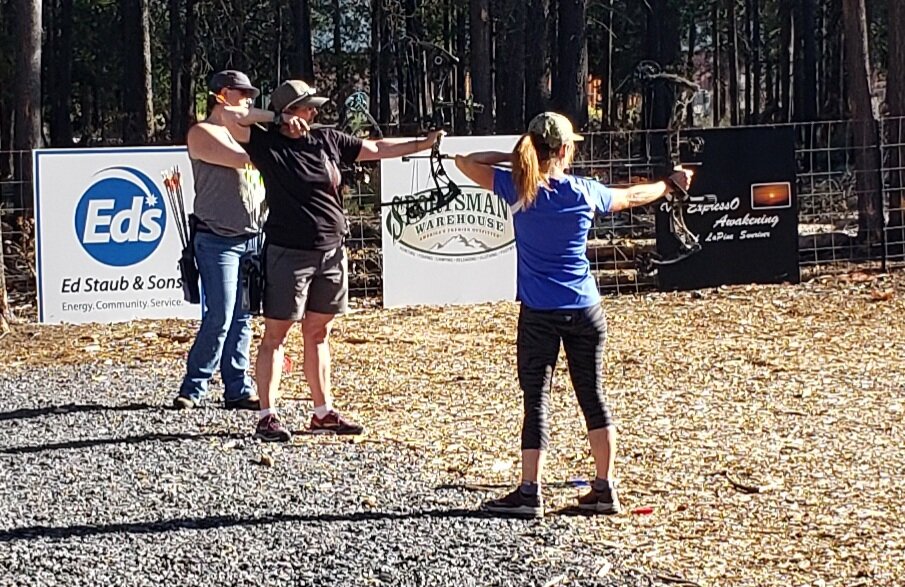
I want to click on posters, so click(73, 258), click(433, 282), click(738, 256).